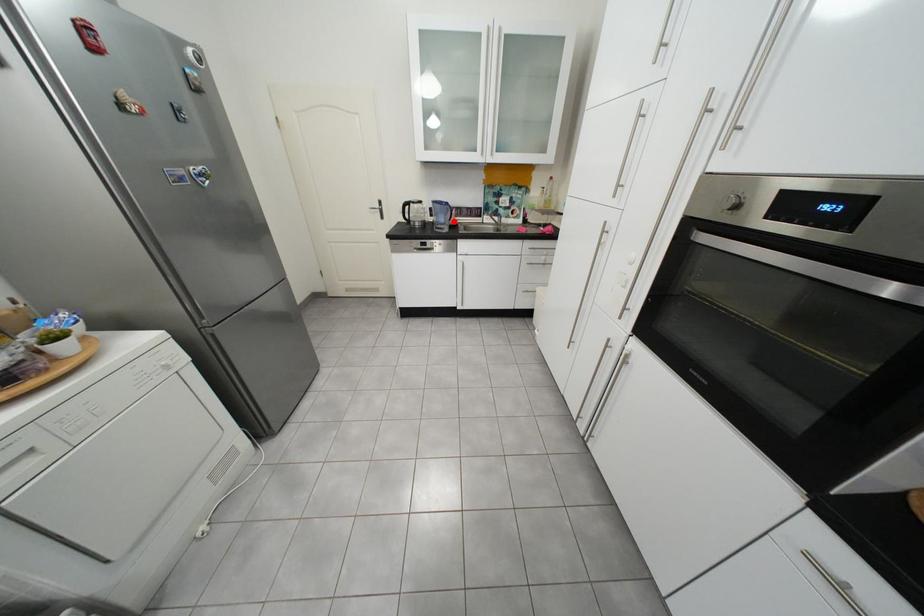
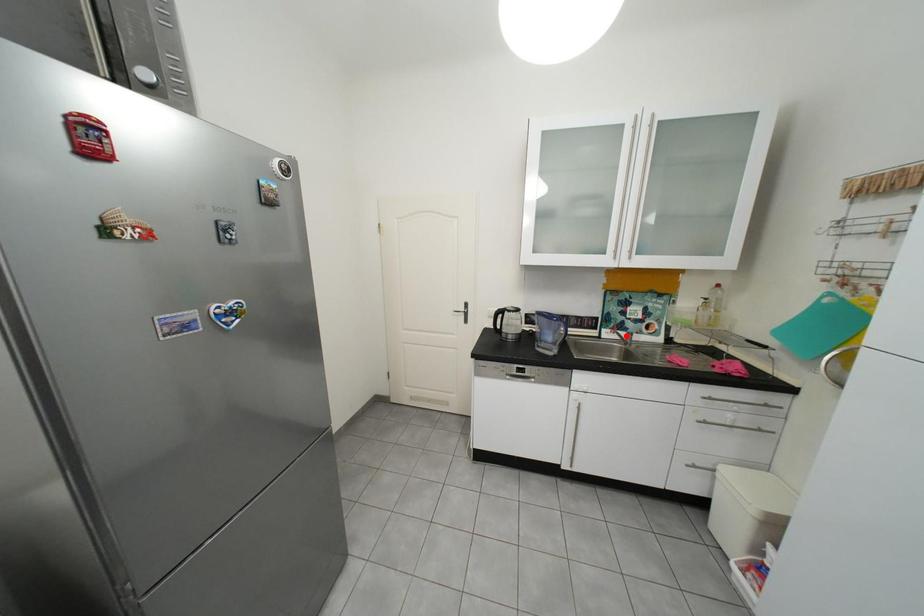
I am providing you with two images of the same scene from different viewpoints. A red point is marked on the first image and another point is marked on the second image. Is the red point in image1 aligned with the point shown in image2?

No